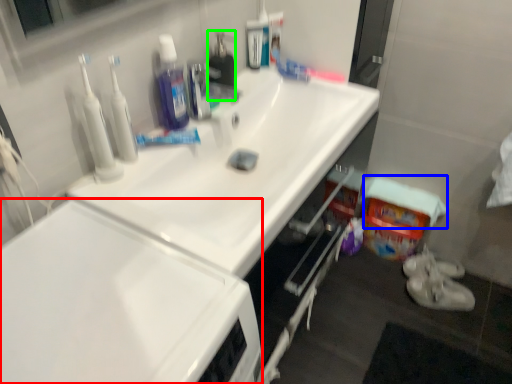
Question: Based on their relative distances, which object is farther from cabinetry (highlighted by a red box)? Choose from towel/napkin (highlighted by a blue box) and cleaning products (highlighted by a green box).

Choices:
 (A) towel/napkin
 (B) cleaning products

Answer: (A)